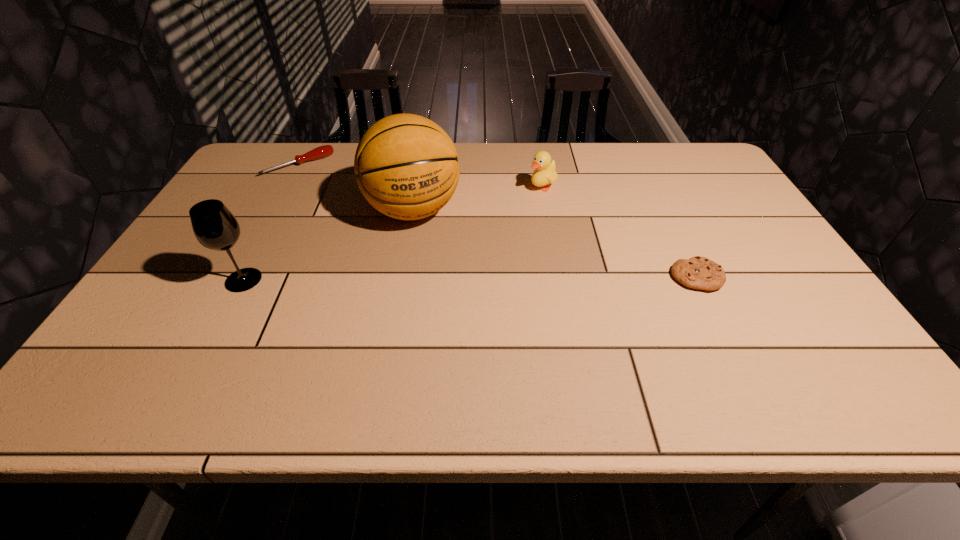
Identify the location of duckling present at the far edge. The height and width of the screenshot is (540, 960). (545, 170).

Where is `wineglass that is at the left edge`? wineglass that is at the left edge is located at coordinates (214, 226).

Locate an element on the screen. This screenshot has width=960, height=540. screwdriver present at the left edge is located at coordinates (320, 152).

Image resolution: width=960 pixels, height=540 pixels. Identify the location of object located in the far left corner section of the desktop. (320, 152).

The height and width of the screenshot is (540, 960). In the image, there is a desktop. What are the coordinates of `free region at the far edge` in the screenshot? It's located at (583, 156).

Where is `vacant space at the left edge of the desktop`? This screenshot has height=540, width=960. vacant space at the left edge of the desktop is located at coordinates (226, 262).

Where is `blank area at the right edge`? Image resolution: width=960 pixels, height=540 pixels. blank area at the right edge is located at coordinates (722, 188).

In the image, there is a desktop. At what (x,y) coordinates should I click in order to perform the action: click on vacant space at the far right corner. Please return your answer as a coordinate pair (x, y). Looking at the image, I should click on (707, 160).

Locate an element on the screen. vacant area that lies between the cookie and the basketball is located at coordinates (555, 244).

The width and height of the screenshot is (960, 540). In order to click on vacant space that is in between the wineglass and the cookie in this screenshot , I will do `click(469, 278)`.